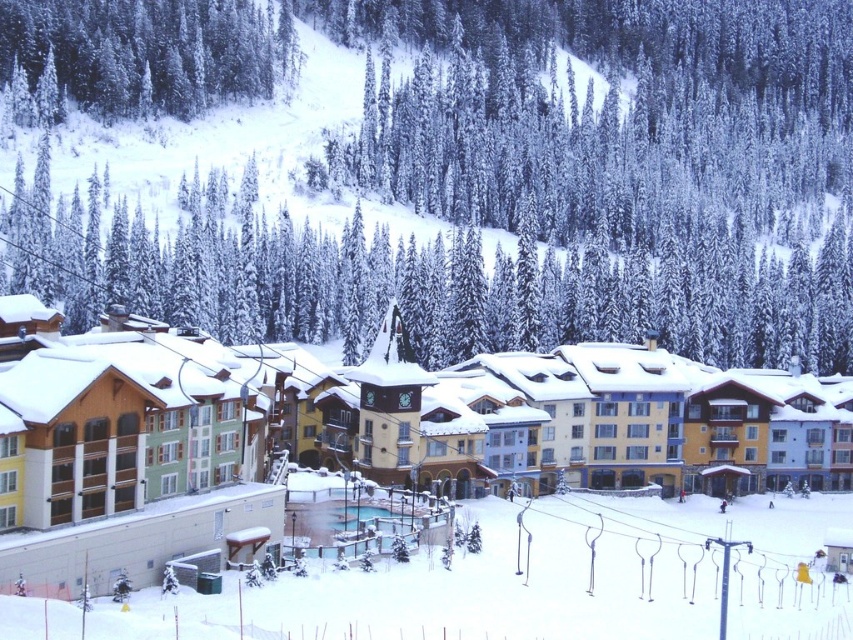
You are standing at the base of the mountain looking at the ski resort. There are two points marked in the image, one at coordinate point (746, 51) and the other at point (41, 376). Which point is closer to you?

Point (41, 376) is closer to you because it is less further to the camera than point (746, 51).